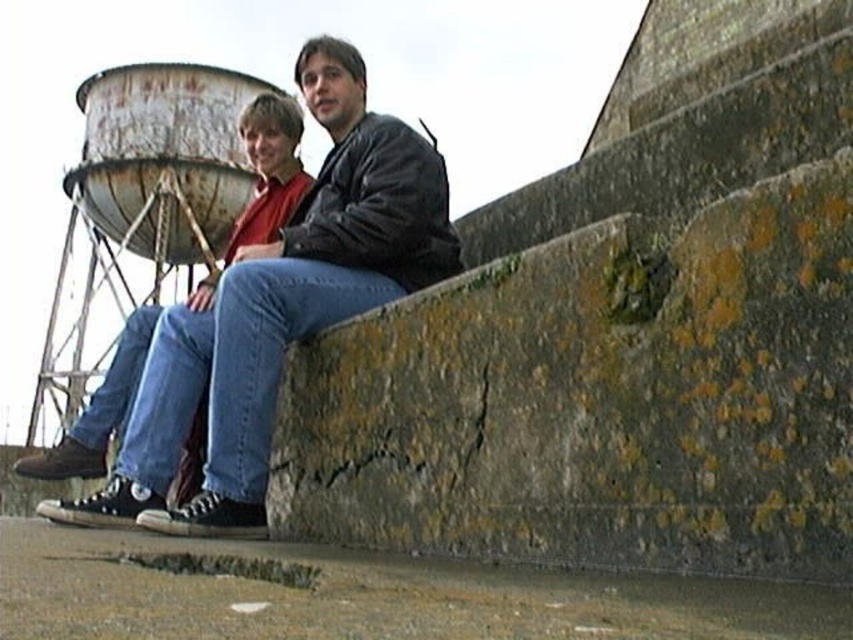
Question: Is the position of denim jeans at center less distant than that of rusty metal water tower at upper left?

Choices:
 (A) yes
 (B) no

Answer: (A)

Question: Among these points, which one is nearest to the camera?

Choices:
 (A) (91, 403)
 (B) (347, 218)

Answer: (B)

Question: Is denim jeans at center below rusty metal water tower at upper left?

Choices:
 (A) yes
 (B) no

Answer: (A)

Question: Which point is closer to the camera?

Choices:
 (A) (250, 362)
 (B) (207, 236)

Answer: (A)

Question: Can you confirm if denim jeans at center is positioned to the left of rusty metal water tower at upper left?

Choices:
 (A) yes
 (B) no

Answer: (B)